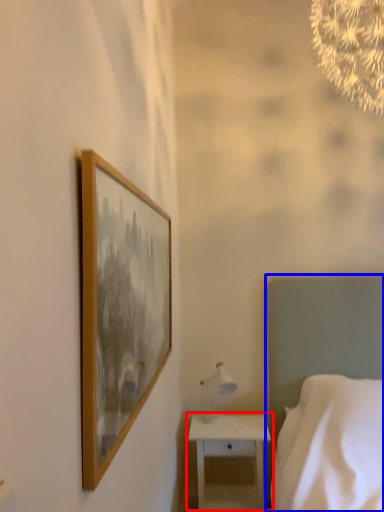
Question: Which of the following is the farthest to the observer, nightstand (highlighted by a red box) or bed (highlighted by a blue box)?

Choices:
 (A) nightstand
 (B) bed

Answer: (A)